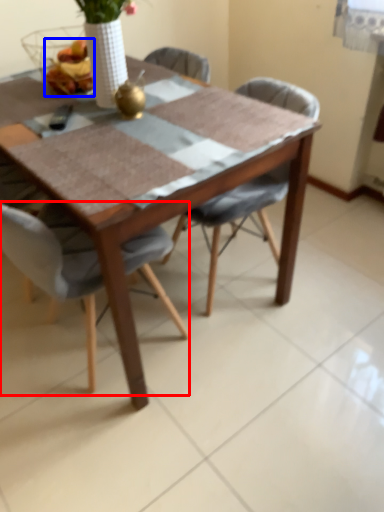
Question: Among these objects, which one is farthest to the camera, chair (highlighted by a red box) or food (highlighted by a blue box)?

Choices:
 (A) chair
 (B) food

Answer: (B)